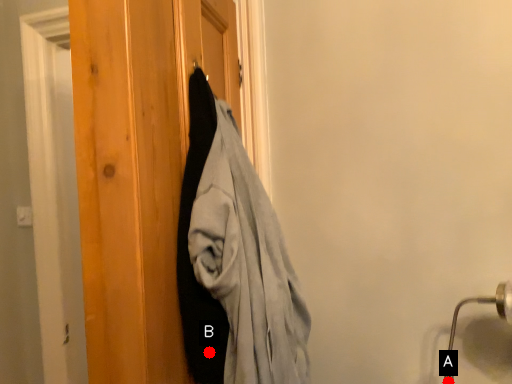
Question: Two points are circled on the image, labeled by A and B beside each circle. Which point appears closest to the camera in this image?

Choices:
 (A) A is closer
 (B) B is closer

Answer: (B)